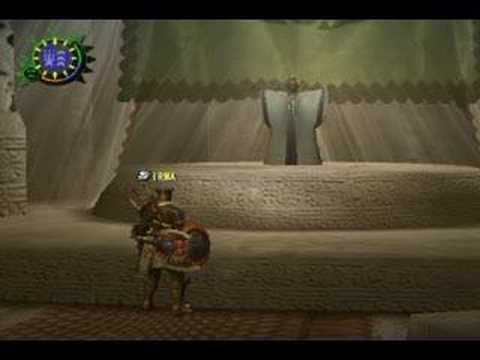
Image resolution: width=480 pixels, height=360 pixels. What are the coordinates of `raised dais` in the screenshot? It's located at (290, 194).